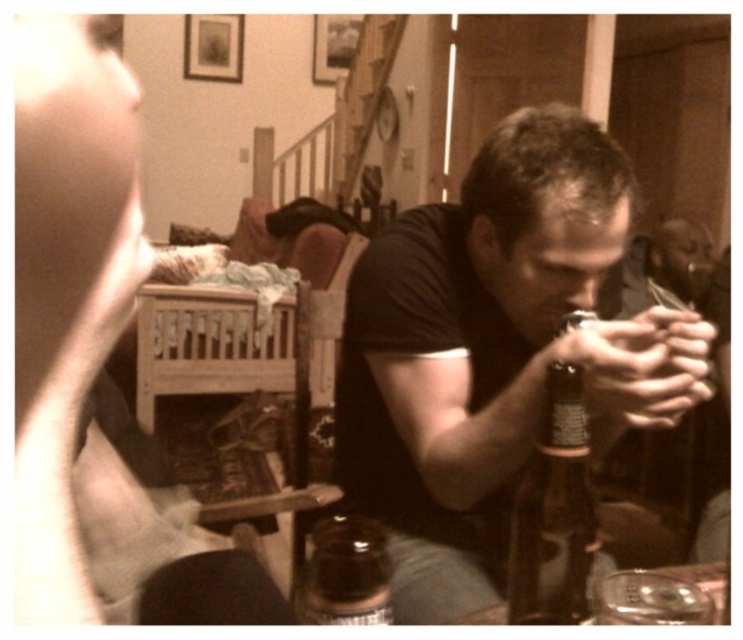
Between matte black camera at center and translucent glass bottle at lower center, which one has less height?

translucent glass bottle at lower center is shorter.

Between point (27, 92) and point (377, 568), which one is positioned in front?

Point (27, 92) is in front.

Is point (134, 104) farther from camera compared to point (334, 621)?

No.

At what (x,y) coordinates should I click in order to perform the action: click on matte black camera at center. Please return your answer as a coordinate pair (x, y). This screenshot has width=743, height=640. Looking at the image, I should click on [x=94, y=360].

Which is more to the right, matte black shirt at center or translucent glass bottle at lower center?

Positioned to the right is matte black shirt at center.

Is point (643, 365) less distant than point (319, 548)?

That is False.

Find the location of a particular element. matte black shirt at center is located at coordinates 493,352.

Can you confirm if matte black camera at center is bigger than brown glass bottle at center?

Yes.

Can you confirm if matte black camera at center is thinner than brown glass bottle at center?

Incorrect, matte black camera at center's width is not less than brown glass bottle at center's.

Is point (162, 612) positioned in front of point (577, 524)?

No, (162, 612) is behind (577, 524).

Where is `matte black camera at center`? The height and width of the screenshot is (640, 743). matte black camera at center is located at coordinates (94, 360).